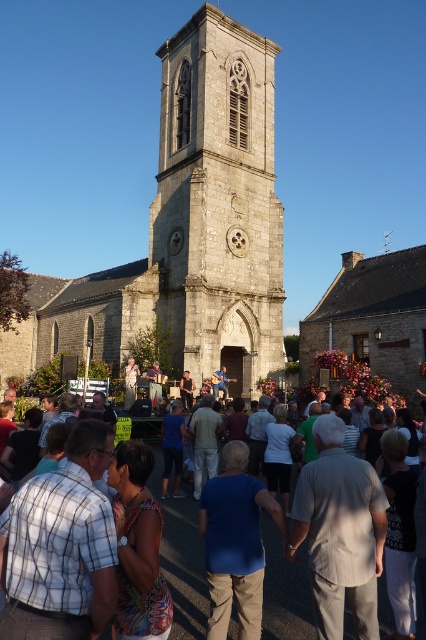
Between stone church at center and stone bell tower at center, which one appears on the left side from the viewer's perspective?

stone church at center

Identify the location of stone church at center. (189, 228).

Is point (95, 291) farther from camera compared to point (219, 65)?

Yes, it is.

Locate an element on the screen. This screenshot has height=640, width=426. stone church at center is located at coordinates (189, 228).

Is stone church at center shorter than white cotton crowd at center?

No.

Is stone church at center to the left of white cotton crowd at center from the viewer's perspective?

Correct, you'll find stone church at center to the left of white cotton crowd at center.

Is point (221, 280) farther from camera compared to point (281, 636)?

That is True.

Where is `stone church at center`? Image resolution: width=426 pixels, height=640 pixels. stone church at center is located at coordinates (189, 228).

Does point (181, 52) come closer to viewer compared to point (227, 637)?

No, it is behind (227, 637).

What do you see at coordinates (218, 202) in the screenshot? The height and width of the screenshot is (640, 426). I see `stone bell tower at center` at bounding box center [218, 202].

You are a GUI agent. You are given a task and a screenshot of the screen. Output one action in this format:
    pyautogui.click(x=<x>, y=<y>)
    Task: Click on the stone bell tower at center
    Image resolution: width=426 pixels, height=640 pixels.
    Given the screenshot: What is the action you would take?
    pyautogui.click(x=218, y=202)